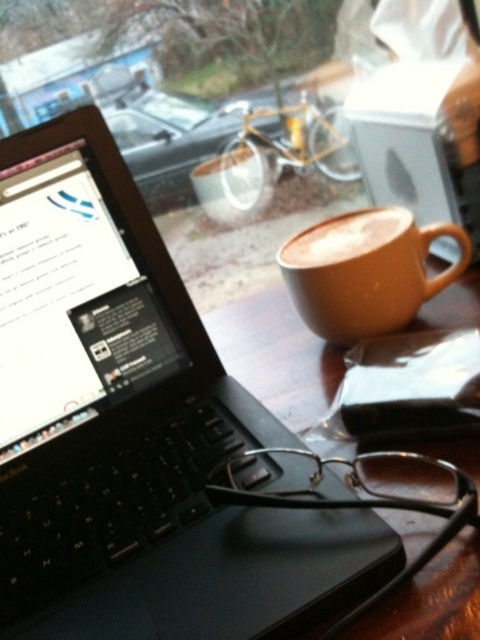
Question: Which point appears closest to the camera in this image?

Choices:
 (A) (143, 353)
 (B) (397, 232)

Answer: (A)

Question: Which point is closer to the camera taking this photo?

Choices:
 (A) (430, 236)
 (B) (416, 321)

Answer: (A)

Question: Does black matte laptop at left have a greater width compared to wooden table at center?

Choices:
 (A) no
 (B) yes

Answer: (B)

Question: Can you confirm if black matte laptop at left is bigger than matte brown mug at center?

Choices:
 (A) no
 (B) yes

Answer: (B)

Question: Which of the following is the farthest from the observer?

Choices:
 (A) (134, 461)
 (B) (436, 228)
 (C) (393, 234)
 (D) (440, 454)

Answer: (B)

Question: Is wooden table at center smaller than matte brown mug at center?

Choices:
 (A) no
 (B) yes

Answer: (A)